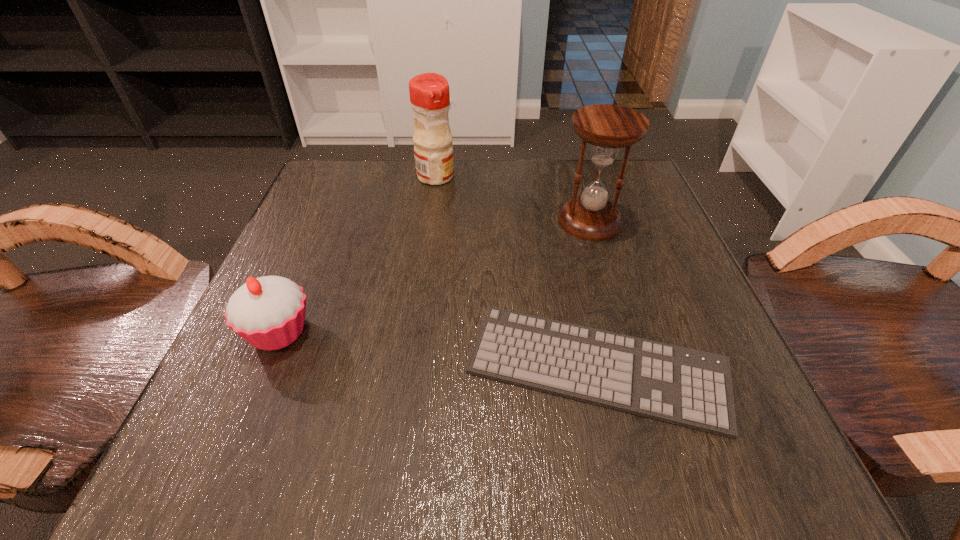
What are the coordinates of `condiment` in the screenshot? It's located at (429, 93).

You are a GUI agent. You are given a task and a screenshot of the screen. Output one action in this format:
    pyautogui.click(x=<x>, y=<y>)
    Task: Click on the farthest object
    
    Given the screenshot: What is the action you would take?
    click(x=429, y=93)

Where is `the second farthest object`? Image resolution: width=960 pixels, height=540 pixels. the second farthest object is located at coordinates (607, 127).

Identify the location of the leftmost object. This screenshot has height=540, width=960. (268, 312).

The image size is (960, 540). I want to click on the second shortest object, so click(x=268, y=312).

Find the location of a particular element. The height and width of the screenshot is (540, 960). the shortest object is located at coordinates (692, 388).

The image size is (960, 540). I want to click on blank space located on the left of the second object from left to right, so click(338, 177).

Locate an element on the screen. Image resolution: width=960 pixels, height=540 pixels. vacant space located 0.090m on the right of the hourglass is located at coordinates (666, 221).

I want to click on vacant space located 0.360m on the right of the leftmost object, so click(548, 332).

This screenshot has width=960, height=540. In order to click on blank space located on the front of the shortest object in this screenshot , I will do `click(622, 479)`.